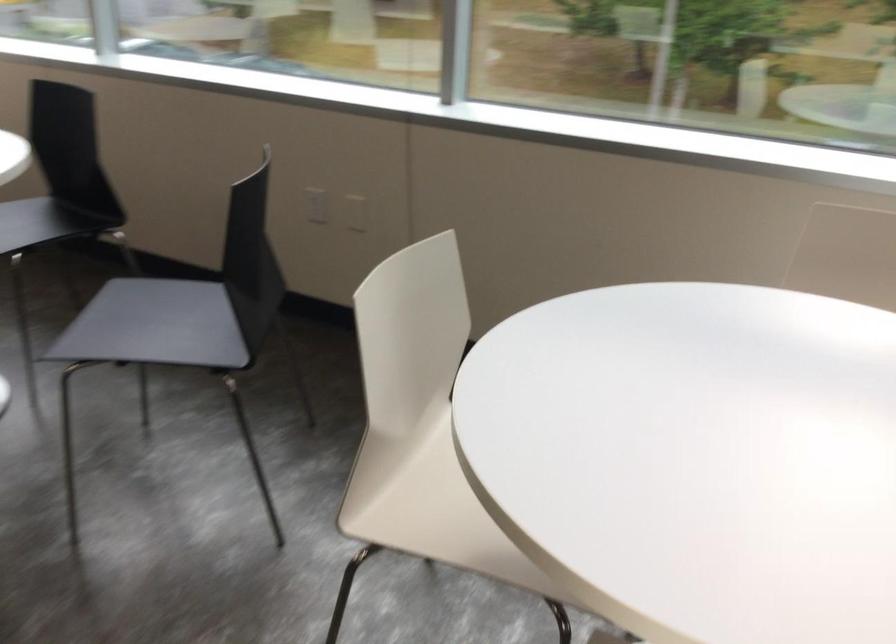
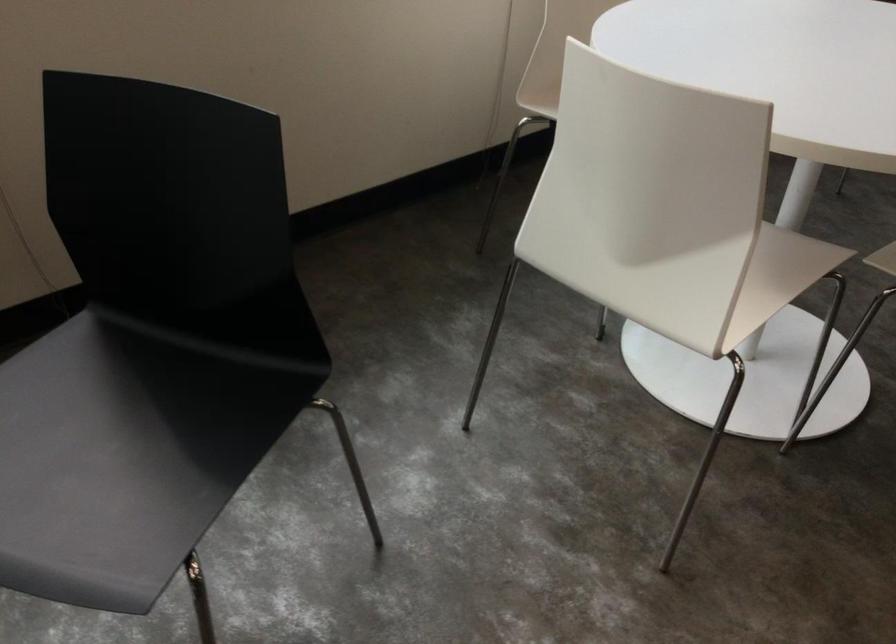
The point at (462, 550) is marked in the first image. Where is the corresponding point in the second image?

(777, 277)